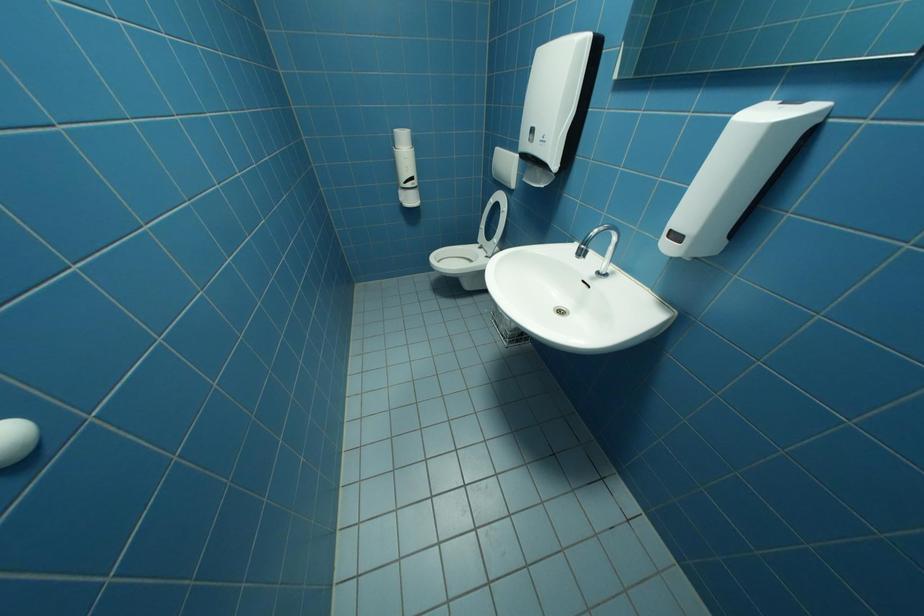
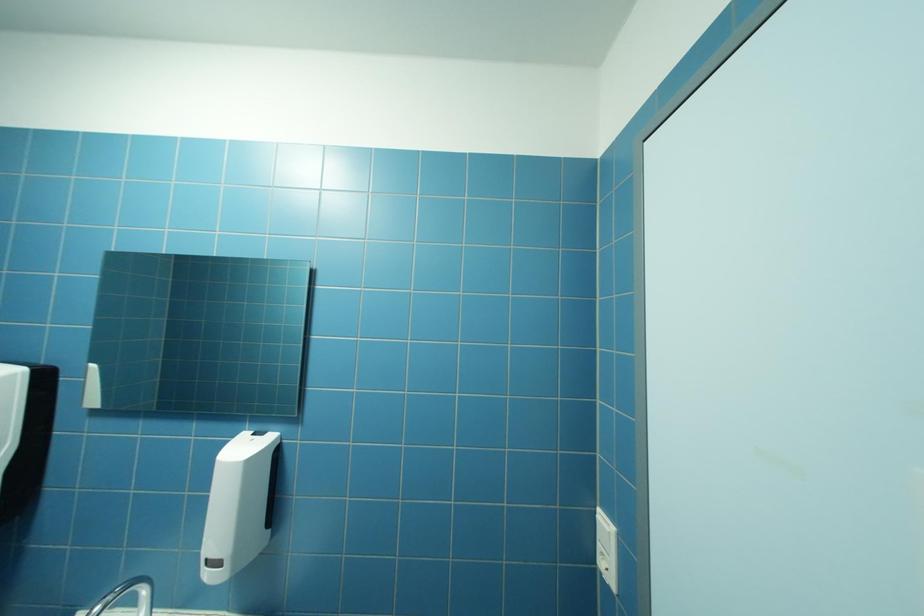
Question: The images are taken continuously from a first-person perspective. In which direction is your viewpoint rotating?

Choices:
 (A) Left
 (B) Right
 (C) Up
 (D) Down

Answer: (B)